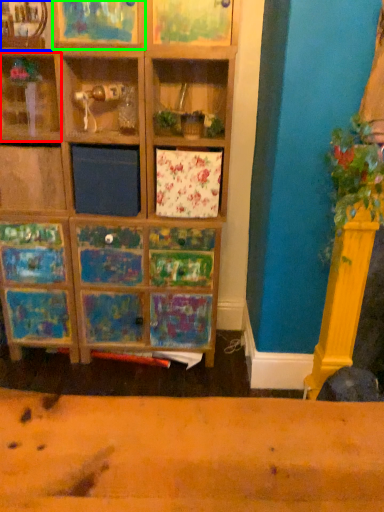
Question: Estimate the real-world distances between objects in this image. Which object is closer to shelf (highlighted by a red box), shelf (highlighted by a blue box) or shelf (highlighted by a green box)?

Choices:
 (A) shelf
 (B) shelf

Answer: (A)